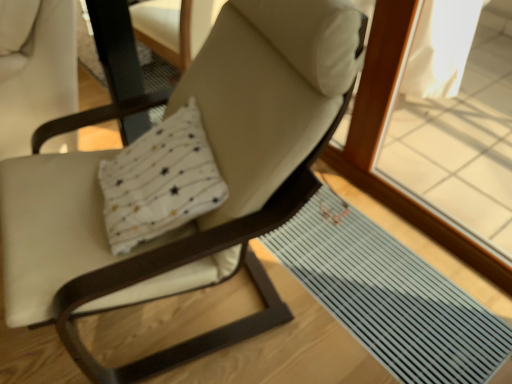
Question: Is point (223, 157) closer or farther from the camera than point (162, 198)?

Choices:
 (A) closer
 (B) farther

Answer: (B)

Question: In terms of height, does matte white chair at center look taller or shorter compared to white soft pillow at center?

Choices:
 (A) tall
 (B) short

Answer: (A)

Question: Based on their relative distances, which object is farther from the white soft pillow at center?

Choices:
 (A) matte white chair at center
 (B) gray rubber mat at lower right
 (C) matte white swivel chair at left

Answer: (B)

Question: Considering the real-world distances, which object is closest to the matte white chair at center?

Choices:
 (A) gray rubber mat at lower right
 (B) white soft pillow at center
 (C) matte white swivel chair at left

Answer: (B)